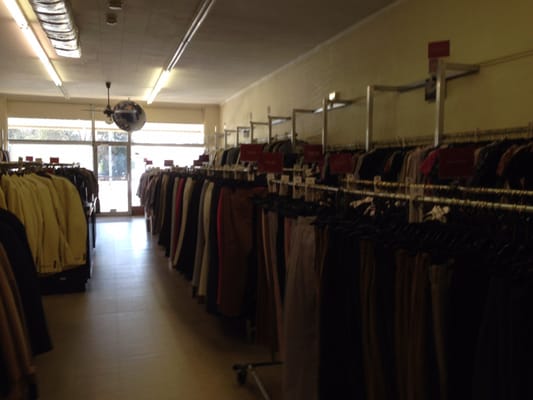
In order to click on rack in this screenshot , I will do 401,188.